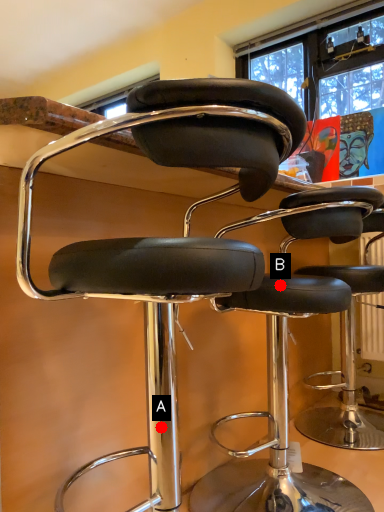
Question: Two points are circled on the image, labeled by A and B beside each circle. Which of the following is the closest to the observer?

Choices:
 (A) A is closer
 (B) B is closer

Answer: (A)